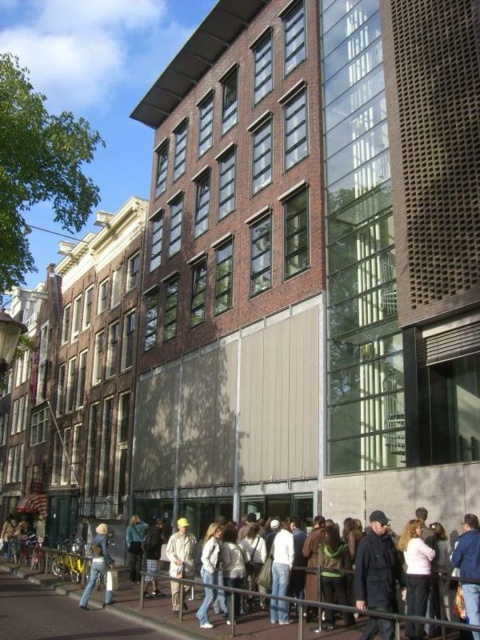
Question: Among these objects, which one is nearest to the camera?

Choices:
 (A) blue denim jeans at lower center
 (B) denim jacket at lower left
 (C) khaki fabric pants at center

Answer: (C)

Question: Considering the relative positions of blue denim jeans at lower center and light brown leather jacket at lower left in the image provided, where is blue denim jeans at lower center located with respect to light brown leather jacket at lower left?

Choices:
 (A) above
 (B) below

Answer: (A)

Question: Which object is the closest to the denim jacket at lower left?

Choices:
 (A) khaki fabric pants at center
 (B) light brown leather jacket at lower left
 (C) blue denim jeans at lower center
 (D) white cotton jacket at lower center

Answer: (C)

Question: Is blue denim jeans at lower center bigger than light brown leather jacket at lower left?

Choices:
 (A) no
 (B) yes

Answer: (A)

Question: Can you confirm if white cotton jacket at lower center is wider than blue denim jeans at lower center?

Choices:
 (A) no
 (B) yes

Answer: (B)

Question: Which object is positioned closest to the light brown leather jacket at lower left?

Choices:
 (A) denim jacket at lower left
 (B) white cotton jacket at lower center
 (C) khaki fabric pants at center

Answer: (A)